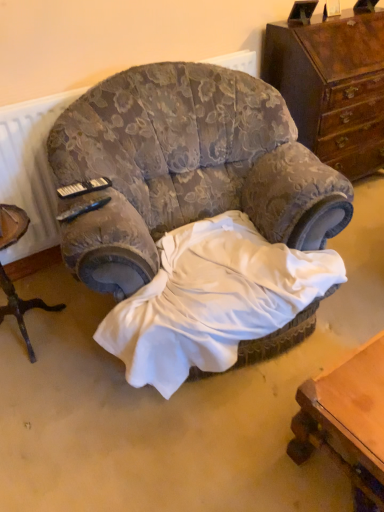
Question: Should I look upward or downward to see wooden tripod table at left?

Choices:
 (A) down
 (B) up

Answer: (A)

Question: Should I look upward or downward to see white satin sheet at center?

Choices:
 (A) down
 (B) up

Answer: (A)

Question: Does wooden tripod table at left have a greater height compared to white satin sheet at center?

Choices:
 (A) no
 (B) yes

Answer: (B)

Question: Considering the relative sizes of wooden tripod table at left and white satin sheet at center in the image provided, is wooden tripod table at left wider than white satin sheet at center?

Choices:
 (A) yes
 (B) no

Answer: (B)

Question: From a real-world perspective, is wooden tripod table at left over white satin sheet at center?

Choices:
 (A) no
 (B) yes

Answer: (B)

Question: Is wooden tripod table at left facing towards white satin sheet at center?

Choices:
 (A) no
 (B) yes

Answer: (A)

Question: From the image's perspective, does wooden tripod table at left appear lower than white satin sheet at center?

Choices:
 (A) yes
 (B) no

Answer: (B)

Question: From a real-world perspective, is wooden tripod table at left located beneath white satin sheet at center?

Choices:
 (A) no
 (B) yes

Answer: (A)

Question: Is wooden tripod table at left taller than velvet floral armchair at center?

Choices:
 (A) no
 (B) yes

Answer: (A)

Question: Considering the relative sizes of wooden tripod table at left and velvet floral armchair at center in the image provided, is wooden tripod table at left wider than velvet floral armchair at center?

Choices:
 (A) no
 (B) yes

Answer: (A)

Question: Considering the relative sizes of wooden tripod table at left and velvet floral armchair at center in the image provided, is wooden tripod table at left smaller than velvet floral armchair at center?

Choices:
 (A) yes
 (B) no

Answer: (A)

Question: Is wooden tripod table at left shorter than velvet floral armchair at center?

Choices:
 (A) yes
 (B) no

Answer: (A)

Question: Is wooden tripod table at left positioned before velvet floral armchair at center?

Choices:
 (A) yes
 (B) no

Answer: (B)

Question: Is wooden tripod table at left looking in the opposite direction of velvet floral armchair at center?

Choices:
 (A) yes
 (B) no

Answer: (B)

Question: Can you confirm if velvet floral armchair at center is shorter than white satin sheet at center?

Choices:
 (A) yes
 (B) no

Answer: (B)